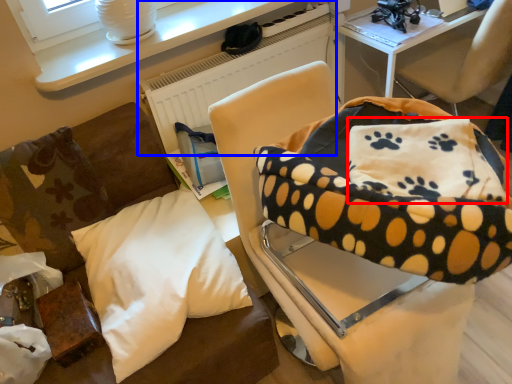
Question: Which of the following is the closest to the observer, pillow (highlighted by a red box) or radiator (highlighted by a blue box)?

Choices:
 (A) pillow
 (B) radiator

Answer: (A)